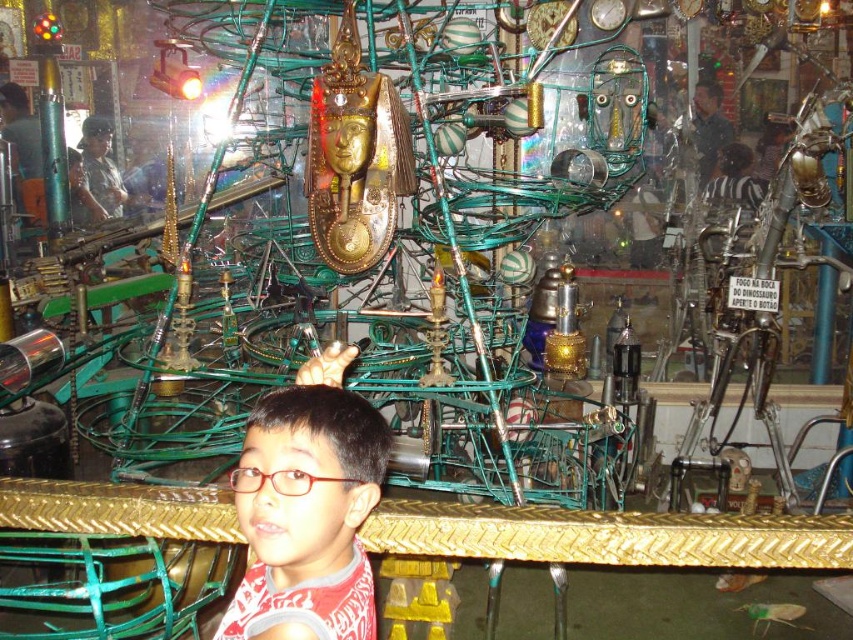
You are a customer in a store and you want to pick up the red matte shirt at center and the red plastic glasses at center. Which one is easier to reach without moving your current position?

The red matte shirt at center is closer to the viewer than the red plastic glasses at center, so it is easier to reach without moving.

You are a customer in a store and you see two items for sale, the red matte shirt at center and the red plastic glasses at center. You want to buy both but have a limited space in your bag. Which item should you choose to take first if you want to maximize the number of items you can carry?

The red plastic glasses at center is smaller in size compared to the red matte shirt at center. To maximize the number of items you can carry, you should take the red plastic glasses at center first, as it takes up less space, allowing more room for additional items.

You are a customer in a store and want to place both the red matte shirt at center and the red plastic glasses at center on a shelf. The shelf has a width of 1 meter. Can you fit both items side by side without overlapping?

The red matte shirt at center might be wider than red plastic glasses at center, so it is uncertain if both will fit on a 1 meter shelf. Measure their combined width to confirm.